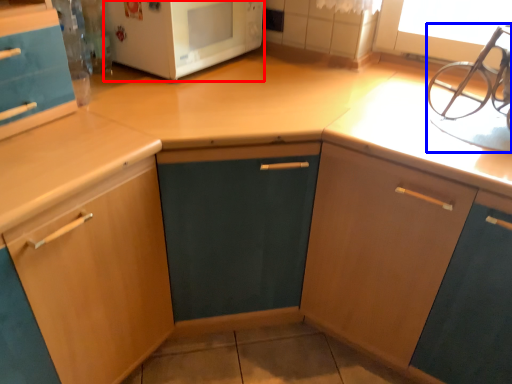
Question: Which object is closer to the camera taking this photo, microwave oven (highlighted by a red box) or sink (highlighted by a blue box)?

Choices:
 (A) microwave oven
 (B) sink

Answer: (B)